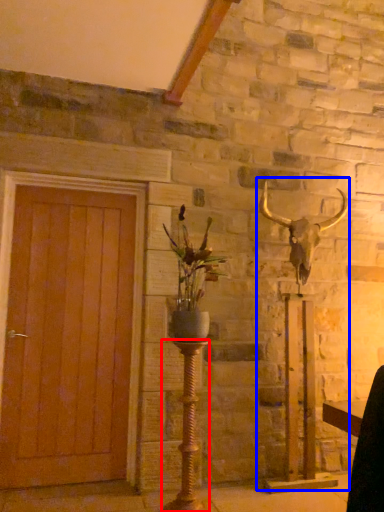
Question: Which of the following is the closest to the observer, candle holder (highlighted by a red box) or sculpture (highlighted by a blue box)?

Choices:
 (A) candle holder
 (B) sculpture

Answer: (A)